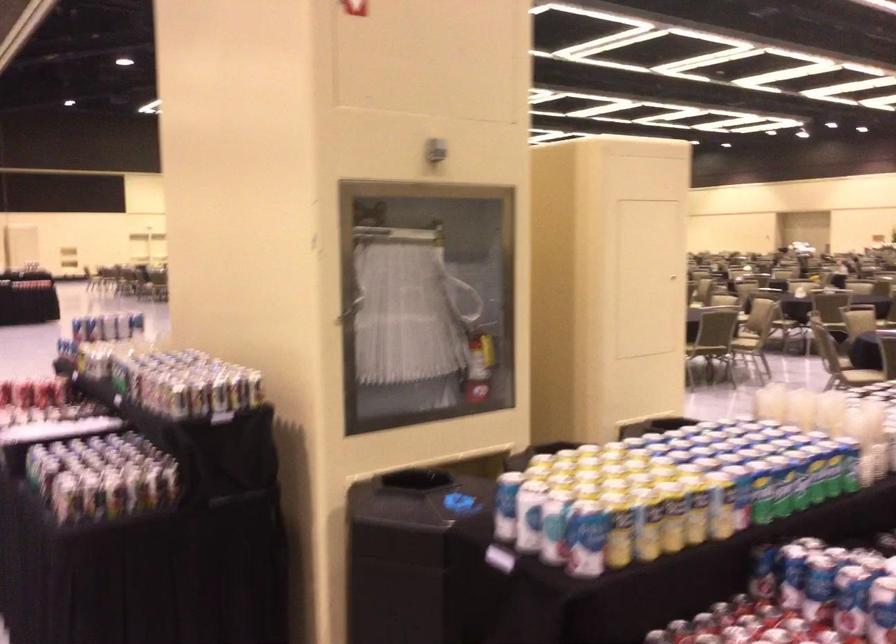
At what (x,y) coordinates should I click in order to perform the action: click on cabinet door handle. Please return your answer as a coordinate pair (x, y). This screenshot has height=644, width=896. Looking at the image, I should click on (349, 310).